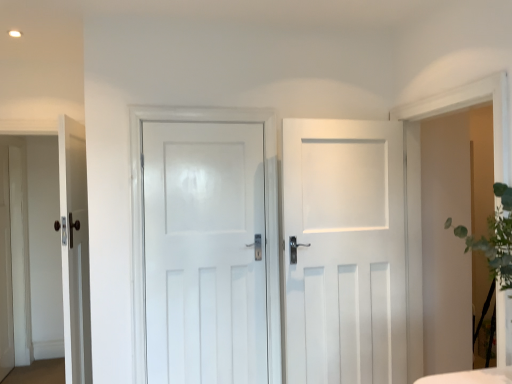
Question: Is point (173, 201) positioned closer to the camera than point (293, 203)?

Choices:
 (A) closer
 (B) farther

Answer: (B)

Question: Relative to white matte door at center, which ranks as the first door in right-to-left order, is white glossy door at center, the 2th door when ordered from left to right, in front or behind?

Choices:
 (A) behind
 (B) front

Answer: (A)

Question: Based on their relative distances, which object is nearer to the white glossy door at center, marked as the second door in a right-to-left arrangement?

Choices:
 (A) white matte door at center, which ranks as the first door in right-to-left order
 (B) matte white door at left, the first door when ordered from left to right

Answer: (A)

Question: Which object is positioned closest to the white glossy door at center, the 2th door when ordered from left to right?

Choices:
 (A) white matte door at center, which is the third door in left-to-right order
 (B) matte white door at left, positioned as the third door in right-to-left order

Answer: (A)